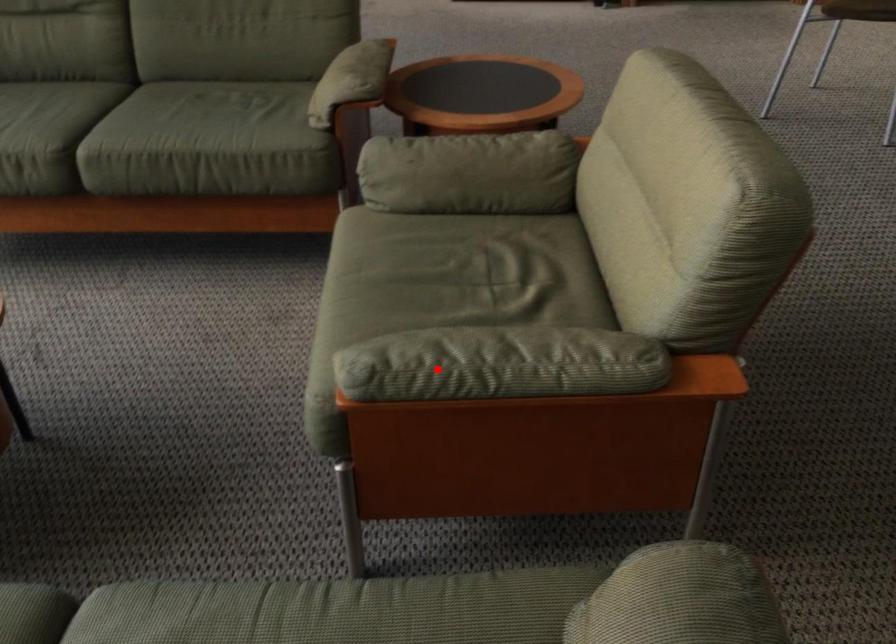
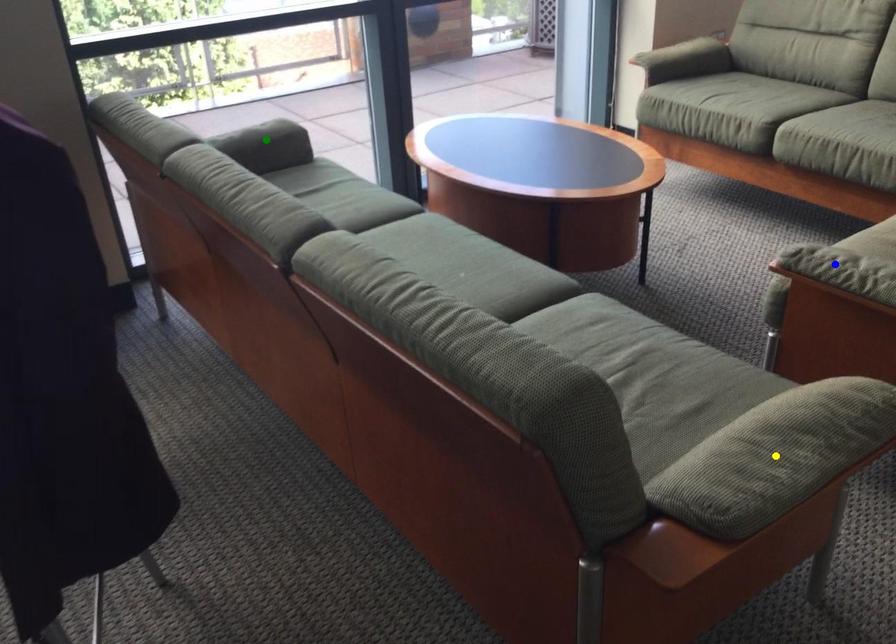
Question: I am providing you with two images of the same scene from different viewpoints. A red point is marked on the first image. You are given multiple points on the second image. Which point in image 2 is actually the same real-world point as the red point in image 1?

Choices:
 (A) green point
 (B) yellow point
 (C) blue point

Answer: (C)